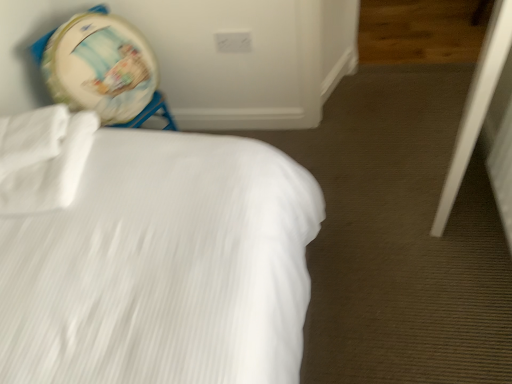
Question: Is point (46, 195) closer or farther from the camera than point (480, 117)?

Choices:
 (A) closer
 (B) farther

Answer: (A)

Question: Considering the relative positions of white matte sheet at upper left and white plastic screen door at lower right in the image provided, is white matte sheet at upper left to the left or to the right of white plastic screen door at lower right?

Choices:
 (A) right
 (B) left

Answer: (B)

Question: Estimate the real-world distances between objects in this image. Which object is closer to the white textured bed at upper left?

Choices:
 (A) white plastic screen door at lower right
 (B) white matte sheet at upper left
 (C) wooden textured drum at upper left

Answer: (B)

Question: Considering the real-world distances, which object is closest to the white matte sheet at upper left?

Choices:
 (A) white textured bed at upper left
 (B) white plastic screen door at lower right
 (C) wooden textured drum at upper left

Answer: (A)